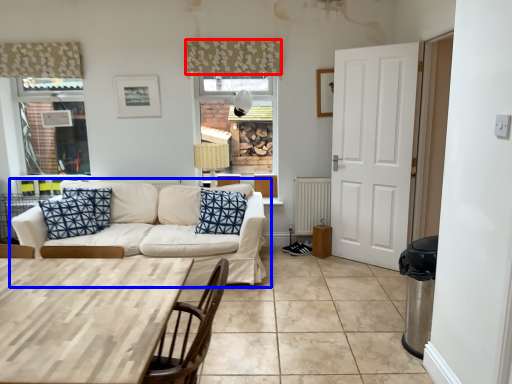
Question: Among these objects, which one is farthest to the camera, curtain (highlighted by a red box) or studio couch (highlighted by a blue box)?

Choices:
 (A) curtain
 (B) studio couch

Answer: (A)